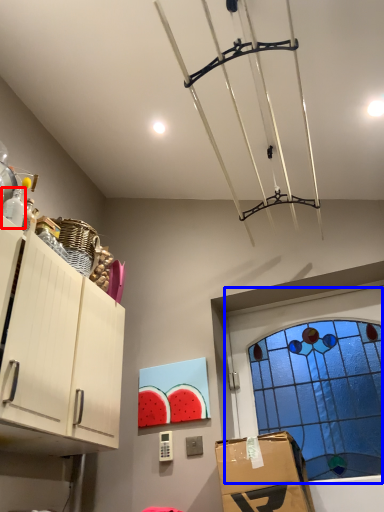
Question: Which object is closer to the camera taking this photo, bottle (highlighted by a red box) or window (highlighted by a blue box)?

Choices:
 (A) bottle
 (B) window

Answer: (A)